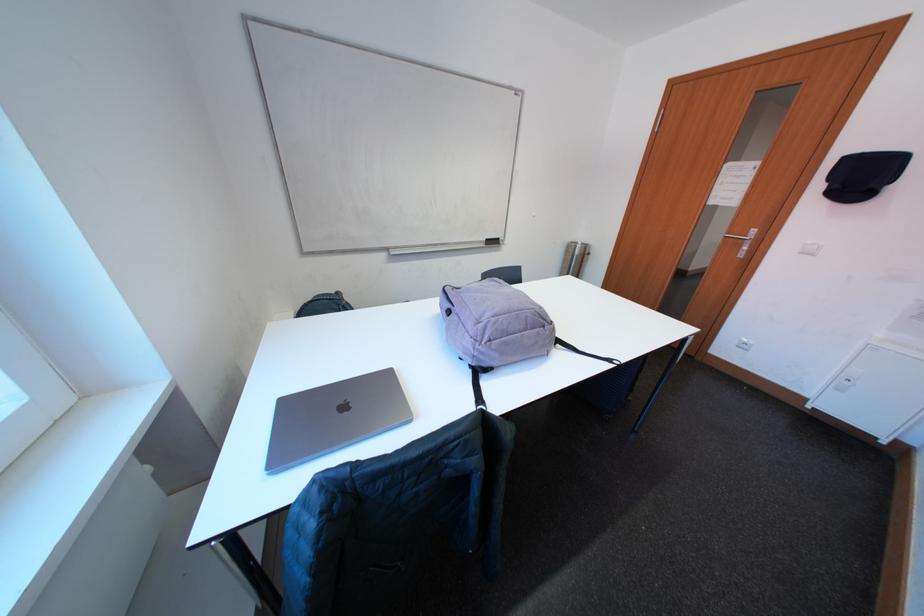
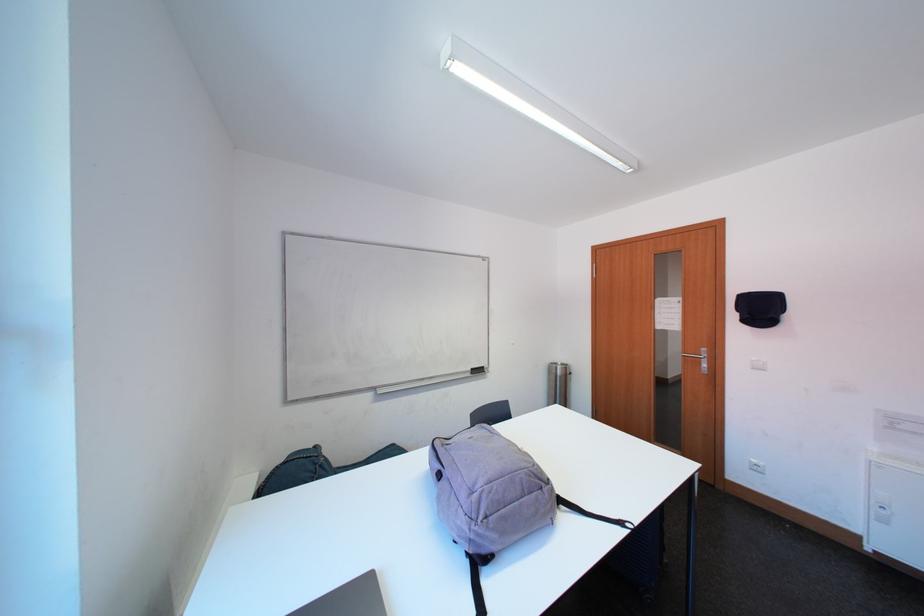
The point at (872, 182) is marked in the first image. Where is the corresponding point in the second image?

(771, 313)